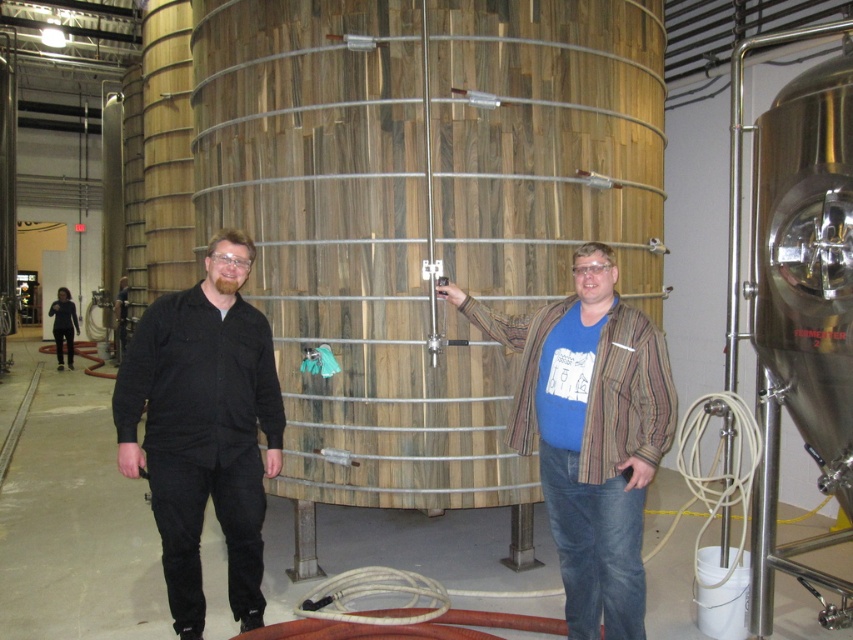
You are a photographer trying to capture a clear image of both the striped cotton shirt at center and the black matte shirt at center. Since you want to ensure both are visible, which shirt should you focus on first to avoid blurring due to their size difference?

The striped cotton shirt at center is larger in size than the black matte shirt at center, so focusing on the larger striped cotton shirt at center first would ensure it is sharp, and then adjust for the smaller black matte shirt at center to keep both in focus.

You are a photographer setting up for a group photo. You need to position the striped cotton shirt at center and the black matte shirt at center so that they are both visible in the frame. Based on their current positions, is there a risk that one might block the other?

The striped cotton shirt at center might be wider than the black matte shirt at center, so there is a risk that the striped cotton shirt at center could block the black matte shirt at center if they are positioned too closely together.

You are a photographer standing at the camera position. You want to take a photo of the fermentation tank and the two people. However, you notice that the point at coordinate point [566,566] is too far away. What is the minimum distance you need to move forward so that this point becomes within 3 meters of the camera?

The point at coordinate point [566,566] is currently 3.42 meters away from the camera. To bring it within 3 meters, you need to move forward by 0.42 meters.